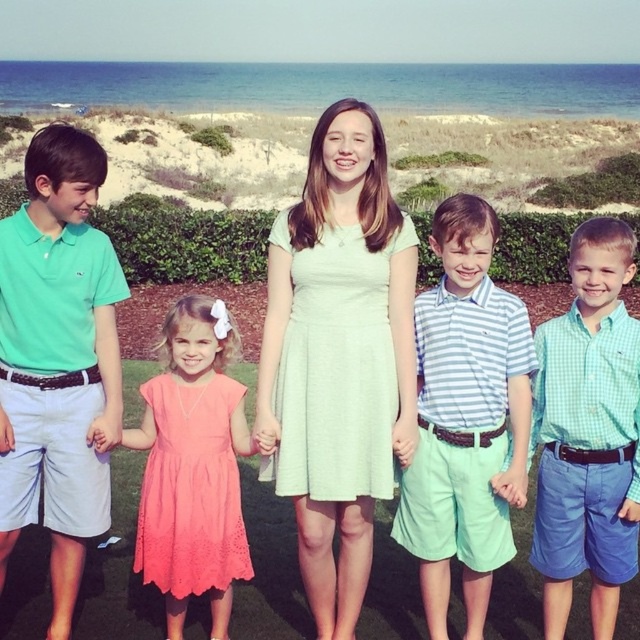
Between point (609, 540) and point (220, 522), which one is positioned behind?

The point (220, 522) is behind.

Who is shorter, green checkered shirt at center or coral lace dress at center?

With less height is coral lace dress at center.

The image size is (640, 640). Describe the element at coordinates (588, 433) in the screenshot. I see `green checkered shirt at center` at that location.

Find the location of a particular element. Image resolution: width=640 pixels, height=640 pixels. green checkered shirt at center is located at coordinates (588, 433).

Between matte green polo shirt at left and striped cotton shirt at center, which one is positioned lower?

striped cotton shirt at center is below.

Does matte green polo shirt at left appear over striped cotton shirt at center?

Correct, matte green polo shirt at left is located above striped cotton shirt at center.

This screenshot has height=640, width=640. What do you see at coordinates (58, 358) in the screenshot?
I see `matte green polo shirt at left` at bounding box center [58, 358].

Find the location of a particular element. The width and height of the screenshot is (640, 640). matte green polo shirt at left is located at coordinates (58, 358).

Can you confirm if light green dress at center is positioned to the right of coral lace dress at center?

Correct, you'll find light green dress at center to the right of coral lace dress at center.

Looking at this image, does light green dress at center have a greater height compared to coral lace dress at center?

Indeed, light green dress at center has a greater height compared to coral lace dress at center.

Locate an element on the screen. light green dress at center is located at coordinates (339, 356).